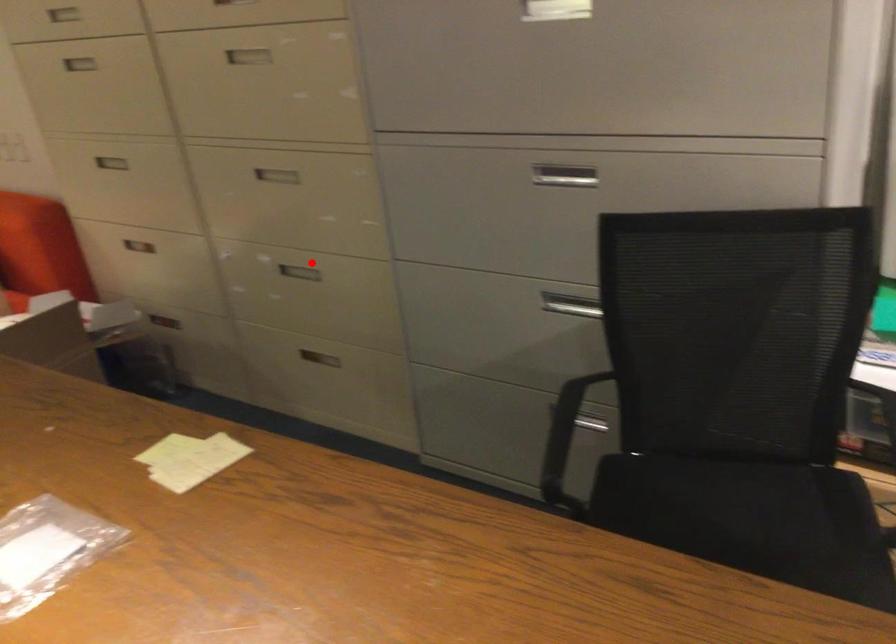
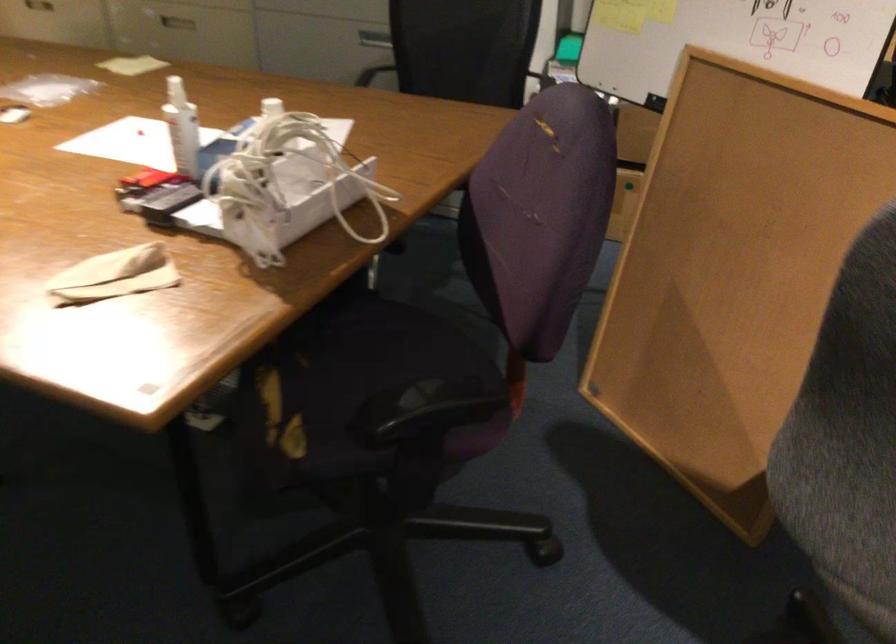
Question: I am providing you with two images of the same scene from different viewpoints. Image1 has a red point marked. In image2, the corresponding 3D location appears at what relative position? Reply with the corresponding letter.

Choices:
 (A) Closer
 (B) Farther

Answer: (B)